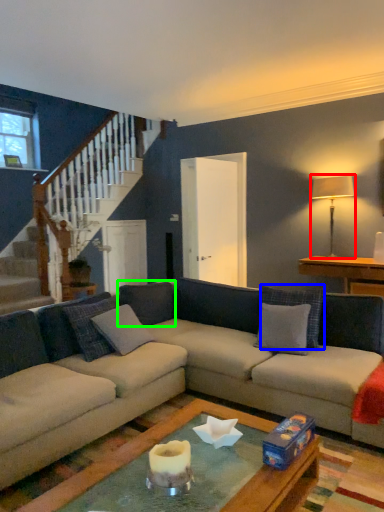
Question: Considering the real-world distances, which object is closest to lamp (highlighted by a red box)? pillow (highlighted by a blue box) or pillow (highlighted by a green box).

Choices:
 (A) pillow
 (B) pillow

Answer: (A)